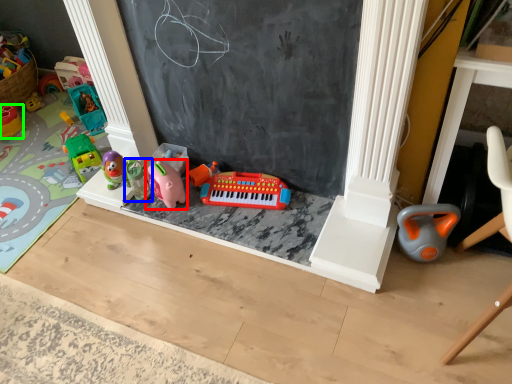
Question: Estimate the real-world distances between objects in this image. Which object is farther from toy (highlighted by a red box), toy (highlighted by a blue box) or toy (highlighted by a green box)?

Choices:
 (A) toy
 (B) toy

Answer: (B)